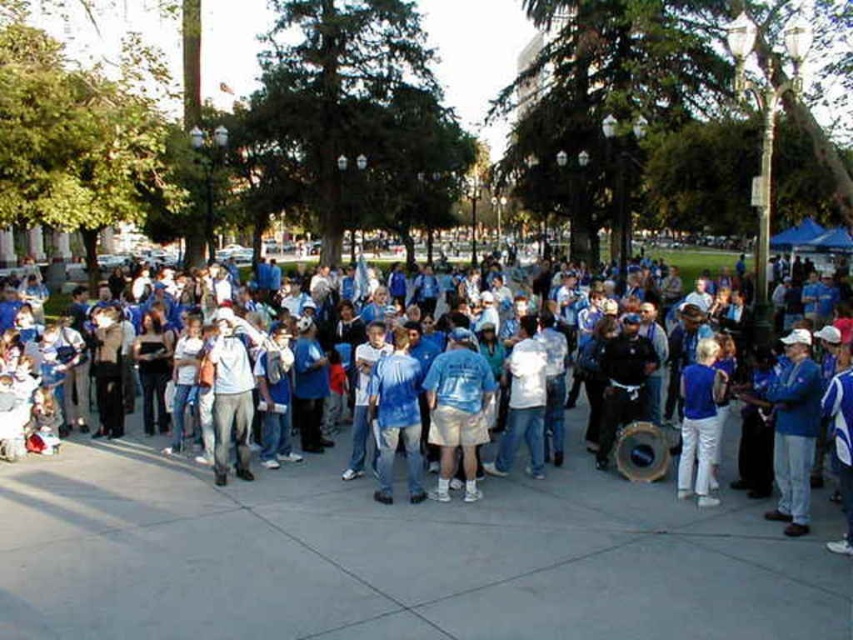
Question: Which object is farther from the camera taking this photo?

Choices:
 (A) blue cotton shirt at center
 (B) blue tie-dye shirt at center

Answer: (B)

Question: Among these points, which one is farthest from the camera?

Choices:
 (A) (761, 444)
 (B) (407, 438)
 (C) (463, 404)

Answer: (B)

Question: Is blue cotton shirts at center to the left of light blue t-shirt at center from the viewer's perspective?

Choices:
 (A) yes
 (B) no

Answer: (B)

Question: Which object is closer to the camera taking this photo?

Choices:
 (A) blue cotton shirts at center
 (B) light blue t-shirt at center
 (C) blue cotton shirt at center

Answer: (A)

Question: Is light blue t-shirt at center bigger than blue cotton shirt at center?

Choices:
 (A) yes
 (B) no

Answer: (B)

Question: Does blue cotton shirts at center have a smaller size compared to light blue t-shirt at center?

Choices:
 (A) no
 (B) yes

Answer: (A)